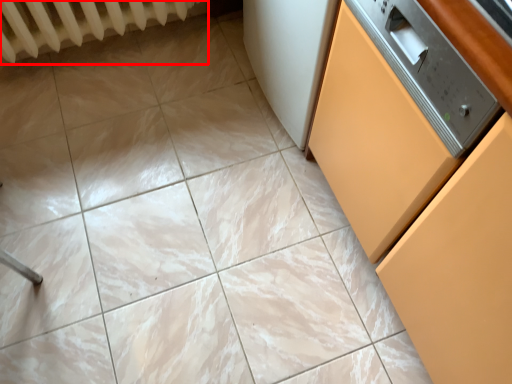
Question: From the image's perspective, considering the relative positions of radiator (annotated by the red box) and cabinetry in the image provided, where is radiator (annotated by the red box) located with respect to the staircase?

Choices:
 (A) below
 (B) above

Answer: (B)